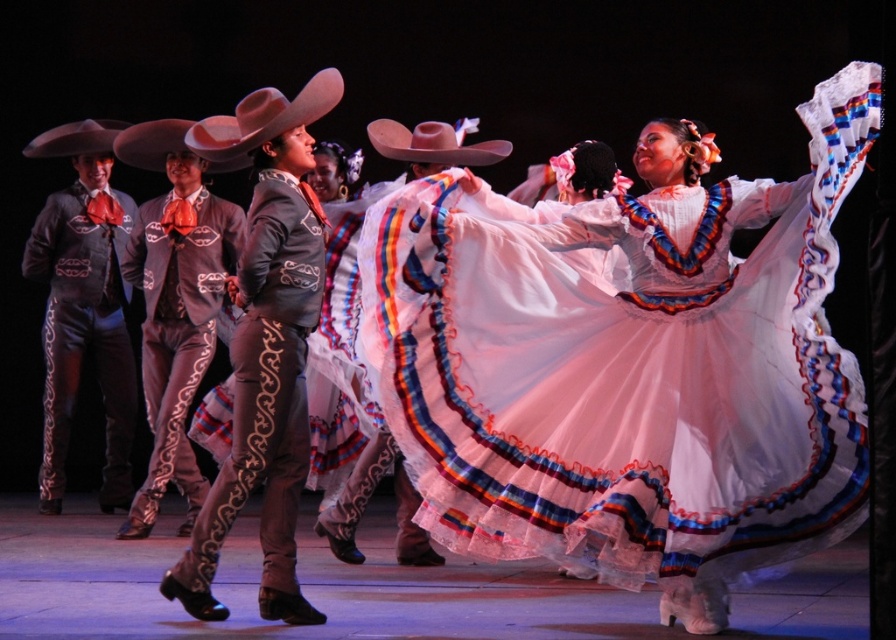
How distant is white satin dress at center from matte black suit at left?

They are 4.45 meters apart.

Can you confirm if white satin dress at center is positioned to the left of matte black suit at left?

Incorrect, white satin dress at center is not on the left side of matte black suit at left.

Between point (713, 189) and point (59, 230), which one is positioned behind?

The point (59, 230) is more distant.

Locate an element on the screen. This screenshot has width=896, height=640. white satin dress at center is located at coordinates (634, 371).

Where is `matte pink cowboy hat at center`? The width and height of the screenshot is (896, 640). matte pink cowboy hat at center is located at coordinates (261, 120).

Image resolution: width=896 pixels, height=640 pixels. Identify the location of matte pink cowboy hat at center. (261, 120).

Where is `matte pink cowboy hat at center`? Image resolution: width=896 pixels, height=640 pixels. matte pink cowboy hat at center is located at coordinates (261, 120).

Can you confirm if gray suede suit at center is bigger than pink felt cowboy hat at center?

Indeed, gray suede suit at center has a larger size compared to pink felt cowboy hat at center.

This screenshot has width=896, height=640. What do you see at coordinates (265, 346) in the screenshot?
I see `gray suede suit at center` at bounding box center [265, 346].

Find the location of a particular element. The height and width of the screenshot is (640, 896). gray suede suit at center is located at coordinates (265, 346).

Identify the location of gray suede suit at center. (265, 346).